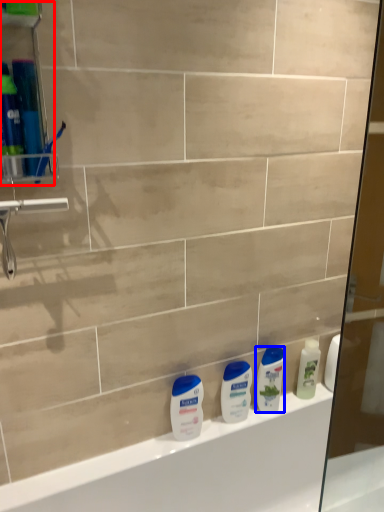
Question: Which point is closer to the camera, shelf (highlighted by a red box) or cleaning product (highlighted by a blue box)?

Choices:
 (A) shelf
 (B) cleaning product

Answer: (A)